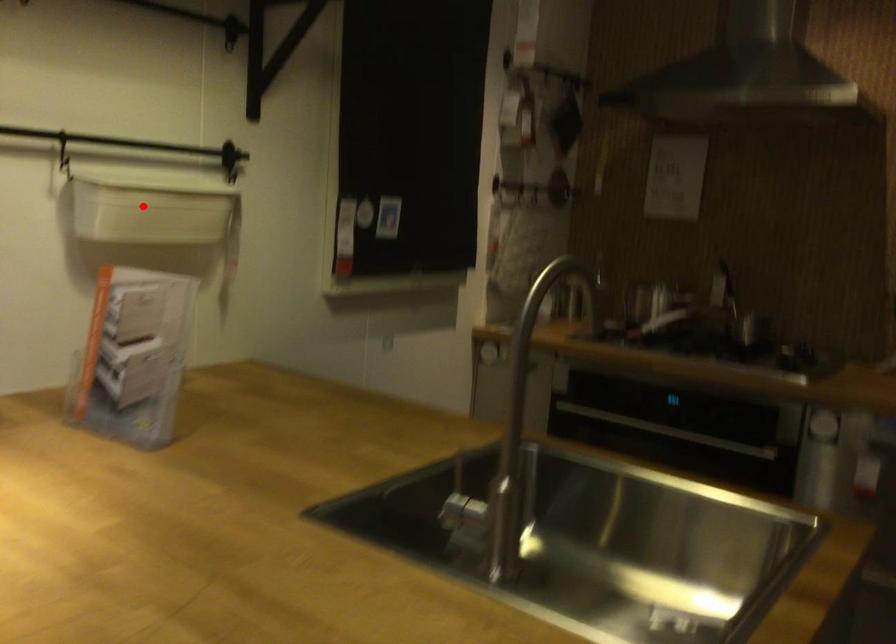
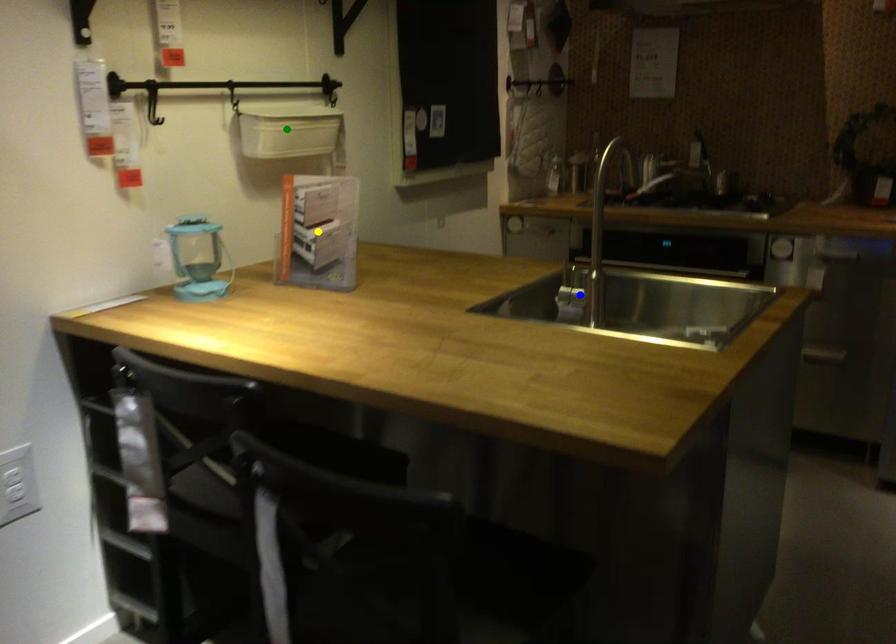
Question: I am providing you with two images of the same scene from different viewpoints. A red point is marked on the first image. You are given multiple points on the second image. Which point in image 2 is actually the same real-world point as the red point in image 1?

Choices:
 (A) yellow point
 (B) green point
 (C) blue point

Answer: (B)